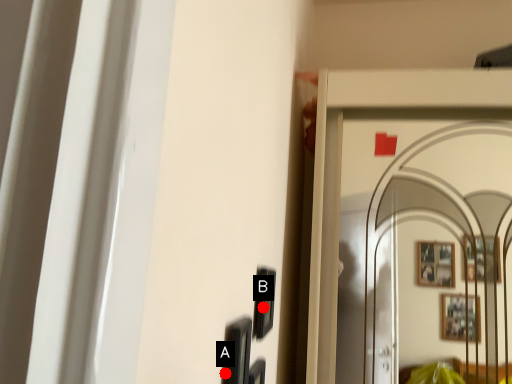
Question: Two points are circled on the image, labeled by A and B beside each circle. Which point appears farthest from the camera in this image?

Choices:
 (A) A is further
 (B) B is further

Answer: (B)